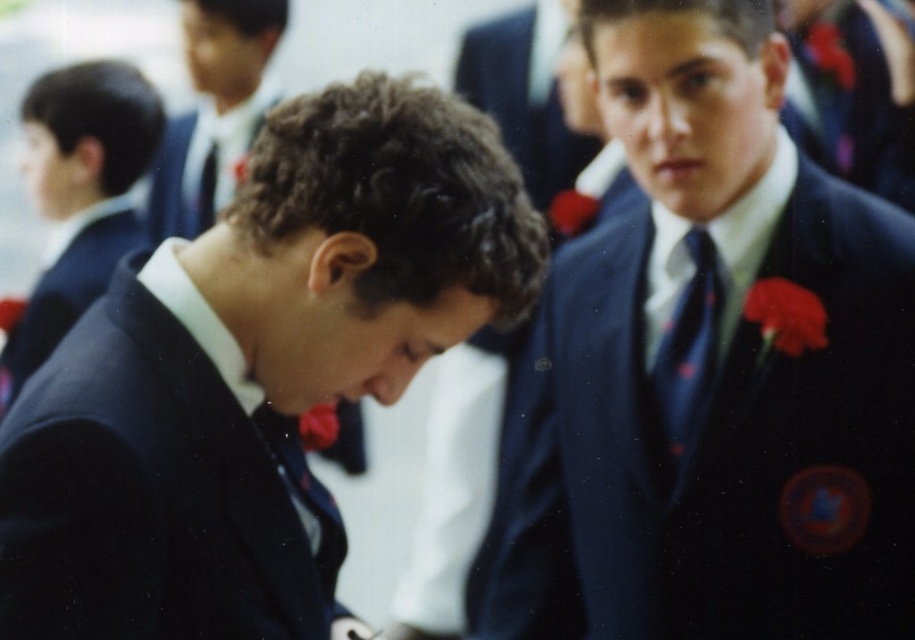
You are a photographer at a formal event and need to adjust the lighting so that the matte blue suit at center and the matte blue tie at center are both visible. Which object should you adjust the light towards to ensure both are properly illuminated?

The matte blue suit at center is positioned on the right side of the matte blue tie at center. To ensure both are properly illuminated, adjust the light towards the matte blue tie at center first, as it is closer to the center and the suit is to its right, allowing the light to naturally spread to both areas.

You are a photographer standing at the edge of the ceremony area. You want to take a photo of the matte blue suit at center and the matte blue tie at center without any obstruction. Given that your camera can focus on objects within a 1.5 meter range, will both items be in focus?

The matte blue suit at center is 1.64 meters away from the matte blue tie at center. Since the camera can only focus within 1.5 meters, the distance between them exceeds the focus range. Therefore, both items cannot be in focus simultaneously.